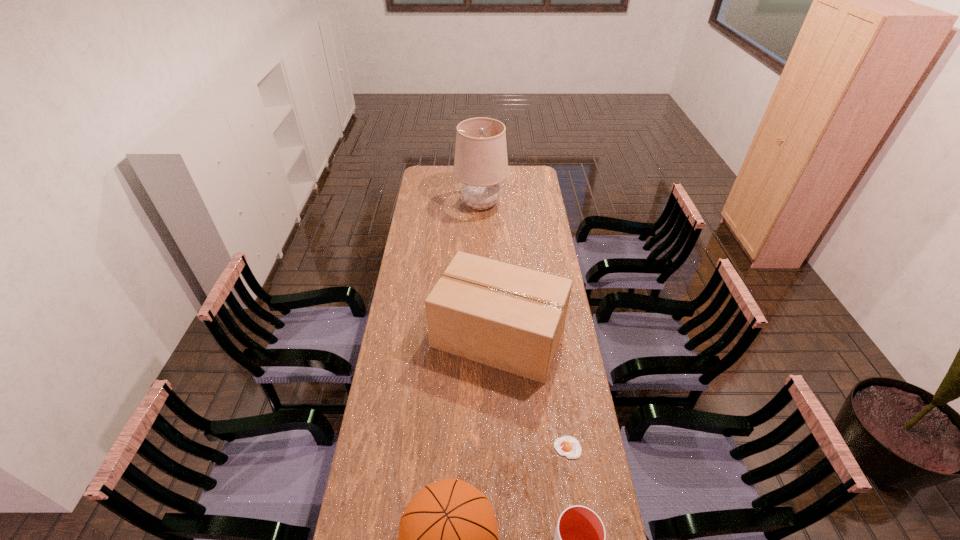
What are the coordinates of `lampshade` in the screenshot? It's located at (480, 163).

Where is `the farthest object`? the farthest object is located at coordinates (480, 163).

Locate an element on the screen. The height and width of the screenshot is (540, 960). the fourth nearest object is located at coordinates (508, 317).

Identify the location of the third farthest object. The width and height of the screenshot is (960, 540). (568, 446).

You are a GUI agent. You are given a task and a screenshot of the screen. Output one action in this format:
    pyautogui.click(x=<x>, y=<y>)
    Task: Click on the shortest object
    The width and height of the screenshot is (960, 540).
    Given the screenshot: What is the action you would take?
    pyautogui.click(x=568, y=446)

Image resolution: width=960 pixels, height=540 pixels. In order to click on free space located 0.190m on the right of the farthest object in this screenshot , I will do `click(541, 204)`.

Identify the location of free point located on the front of the fourth nearest object. (501, 409).

Identify the location of free region located on the left of the shortest object. Image resolution: width=960 pixels, height=540 pixels. pyautogui.click(x=511, y=448).

You are a GUI agent. You are given a task and a screenshot of the screen. Output one action in this format:
    pyautogui.click(x=<x>, y=<y>)
    Task: Click on the box present at the right edge
    The height and width of the screenshot is (540, 960).
    Given the screenshot: What is the action you would take?
    pyautogui.click(x=508, y=317)

This screenshot has height=540, width=960. Identify the location of egg yolk that is at the right edge. (568, 446).